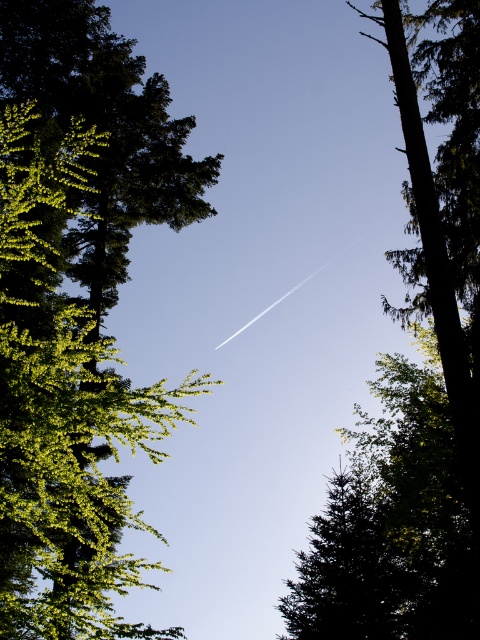
How much distance is there between green leafy tree at upper left and green textured tree at lower center?

They are 11.56 meters apart.

Who is shorter, green leafy tree at upper left or green textured tree at lower center?

Standing shorter between the two is green textured tree at lower center.

What do you see at coordinates (76, 308) in the screenshot?
I see `green leafy tree at upper left` at bounding box center [76, 308].

Locate an element on the screen. The width and height of the screenshot is (480, 640). green leafy tree at upper left is located at coordinates (76, 308).